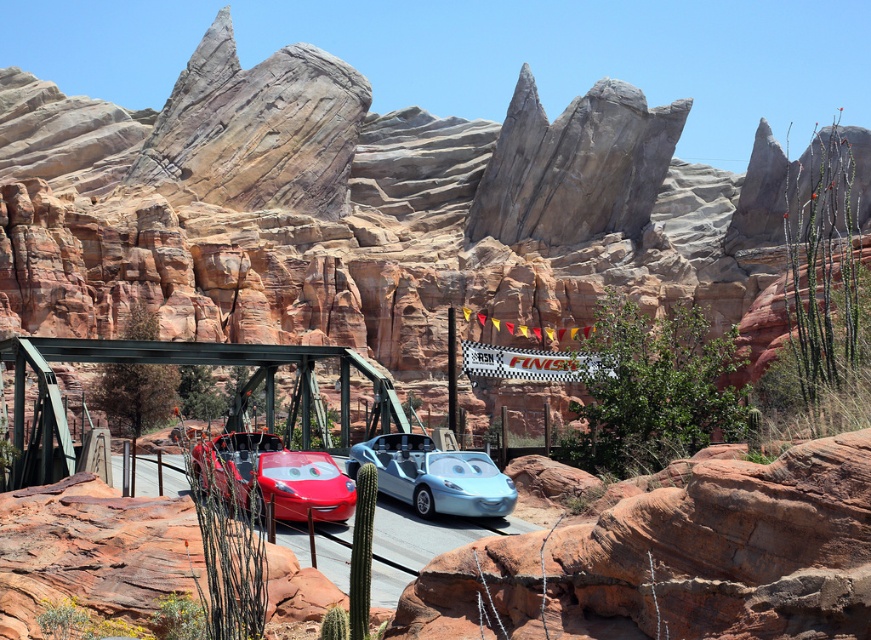
You are a visitor at this Cars theme park and want to take a photo of the shiny metallic car at center from the metallic steel bridge at center. Can you stand on the bridge to take the photo?

The metallic steel bridge at center is to the left of the shiny metallic car at center, so yes, you can stand on the metallic steel bridge at center and take a photo of the shiny metallic car at center from that position.

You are standing at the entrance of the desert attraction and see the metallic steel bridge at center. Can you confirm if the bridge is located exactly at the coordinate point (194, 364)?

Yes, the metallic steel bridge at center is represented by point (194, 364), so the bridge is indeed located at that coordinate.

You are standing at the starting point of the road in this Cars theme park scene. You see two points marked on the road ahead. The first point is at coordinates point (395, 401) and the second is at point (512, 483). Which point is closer to you as you face the road?

Point (395, 401) is closer to you because it is further to the viewer than point (512, 483), meaning it is nearer in the scene.